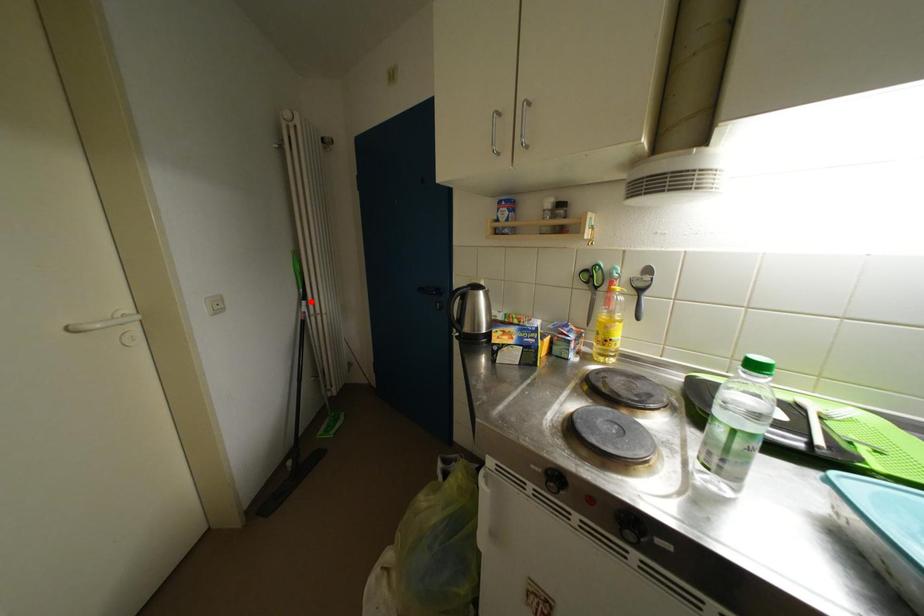
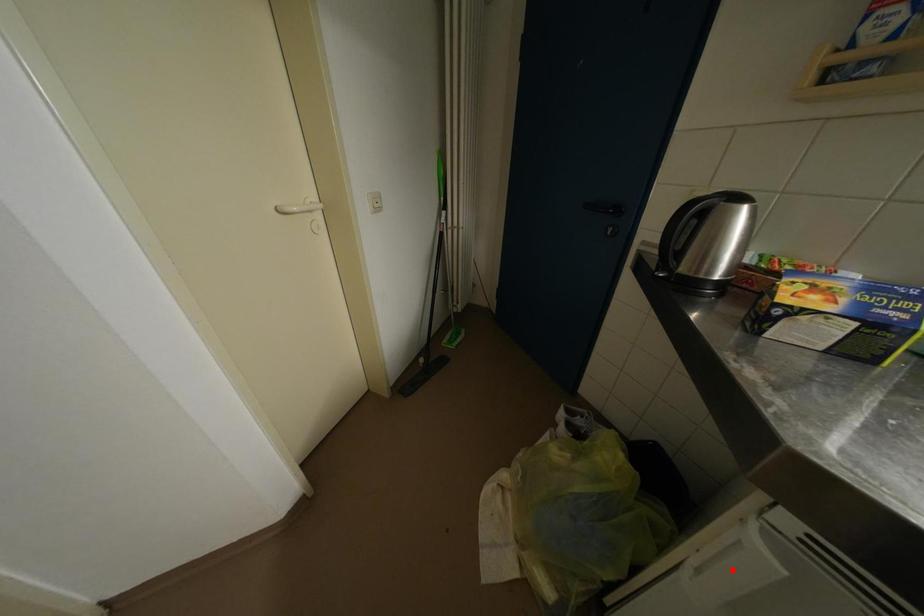
I am providing you with two images of the same scene from different viewpoints. A red point is marked on the first image and another point is marked on the second image. Does the point marked in image1 correspond to the same location as the one in image2?

No